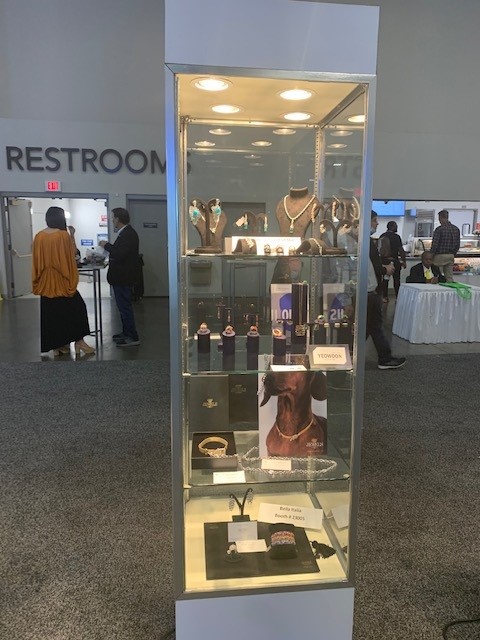
Identify the location of door. This screenshot has width=480, height=640. (18, 221), (157, 234).